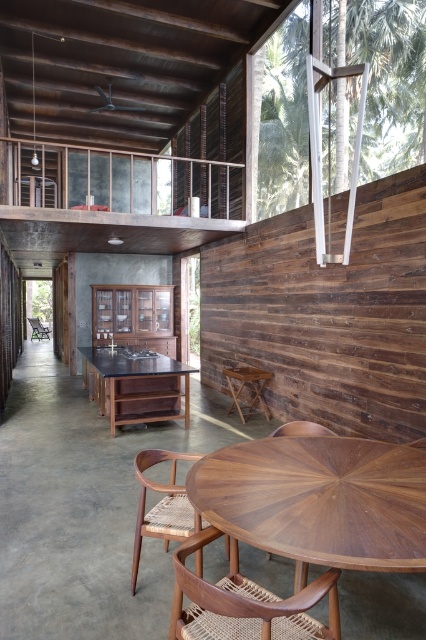
You are standing at the point marked as point (163, 506) in the image. Looking around, you see a round wooden dining table with a radial pattern and four chairs with woven seats and backrests. Which object is directly under your feet?

The point (163, 506) is on the rattan woven chair at lower center, so the object directly under your feet is the rattan woven chair at lower center.

You are standing at the entrance of the room and want to move towards the rattan woven chair at lower center. According to the coordinates provided, in which direction should you move relative to your current position?

The rattan woven chair at lower center is located at point 0.791 on the x axis and 0.383 on the y axis. Since you are at the entrance, which is typically at the lower left corner of the room, you should move towards the right and slightly forward to reach the chair.

You are standing at the entrance of the room and want to find the black wood table at center. According to the coordinates provided, in which direction should you move relative to your current position?

The black wood table at center is located at coordinates point (x=135, y=385). Since you are at the entrance, you should move towards the center of the room to reach it.